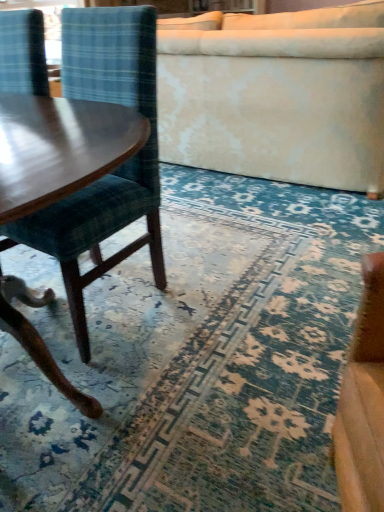
Identify the location of blue textured rug at center. (196, 358).

This screenshot has width=384, height=512. What do you see at coordinates (276, 95) in the screenshot?
I see `velvet cream studio couch at upper center` at bounding box center [276, 95].

You are a GUI agent. You are given a task and a screenshot of the screen. Output one action in this format:
    pyautogui.click(x=<x>, y=<y>)
    Task: Click on the velvet plaid chair at left
    This screenshot has height=512, width=384.
    Given the screenshot: What is the action you would take?
    pyautogui.click(x=118, y=168)

Image resolution: width=384 pixels, height=512 pixels. Find the location of `blue textured rug at center`. blue textured rug at center is located at coordinates (196, 358).

Is velvet plaid chair at left thinner than blue textured rug at center?

Yes, velvet plaid chair at left is thinner than blue textured rug at center.

Is point (135, 80) behind point (307, 480)?

That is True.

Can you confirm if velvet plaid chair at left is positioned to the right of blue textured rug at center?

Answer: In fact, velvet plaid chair at left is to the left of blue textured rug at center.

What's the angular difference between velvet plaid chair at left and blue textured rug at center's facing directions?

The angle between the facing direction of velvet plaid chair at left and the facing direction of blue textured rug at center is 177 degrees.

Is point (189, 28) less distant than point (381, 228)?

No, it is not.

Is velvet cream studio couch at upper center facing away from blue textured rug at center?

Correct, velvet cream studio couch at upper center is looking away from blue textured rug at center.

Is blue textured rug at center inside velvet cream studio couch at upper center?

No, blue textured rug at center is not surrounded by velvet cream studio couch at upper center.

You are a GUI agent. You are given a task and a screenshot of the screen. Output one action in this format:
    pyautogui.click(x=<x>, y=<y>)
    Task: Click on the mat below the velvet cream studio couch at upper center (from the image's perspective)
    The image size is (384, 512).
    Given the screenshot: What is the action you would take?
    pyautogui.click(x=196, y=358)

Is blue textured rug at center wider or thinner than velvet plaid chair at left?

Considering their sizes, blue textured rug at center looks broader than velvet plaid chair at left.

Is blue textured rug at center looking in the opposite direction of velvet plaid chair at left?

That's not correct — blue textured rug at center is not looking away from velvet plaid chair at left.

Consider the image. What's the angular difference between blue textured rug at center and velvet plaid chair at left's facing directions?

177 degrees.

Is blue textured rug at center inside or outside of velvet plaid chair at left?

blue textured rug at center cannot be found inside velvet plaid chair at left.

From the picture: Between velvet cream studio couch at upper center and velvet plaid chair at left, which one appears on the right side from the viewer's perspective?

Positioned to the right is velvet cream studio couch at upper center.

Considering the sizes of objects velvet cream studio couch at upper center and velvet plaid chair at left in the image provided, who is smaller, velvet cream studio couch at upper center or velvet plaid chair at left?

Smaller between the two is velvet plaid chair at left.

Is velvet cream studio couch at upper center not inside velvet plaid chair at left?

Absolutely, velvet cream studio couch at upper center is external to velvet plaid chair at left.

From a real-world perspective, who is located lower, velvet cream studio couch at upper center or velvet plaid chair at left?

velvet cream studio couch at upper center is physically lower.

Does blue textured rug at center appear on the left side of velvet cream studio couch at upper center?

Yes.

Is blue textured rug at center not within velvet cream studio couch at upper center?

blue textured rug at center lies outside velvet cream studio couch at upper center's area.

Identify the location of studio couch above the blue textured rug at center (from the image's perspective). (276, 95).

What's the angular difference between blue textured rug at center and velvet cream studio couch at upper center's facing directions?

1.34 degrees separate the facing orientations of blue textured rug at center and velvet cream studio couch at upper center.

Is velvet plaid chair at left bigger or smaller than velvet cream studio couch at upper center?

Clearly, velvet plaid chair at left is smaller in size than velvet cream studio couch at upper center.

Which object is thinner, velvet plaid chair at left or velvet cream studio couch at upper center?

With smaller width is velvet plaid chair at left.

From the image's perspective, is velvet plaid chair at left located above or below velvet cream studio couch at upper center?

Clearly, from the image's perspective, velvet plaid chair at left is below velvet cream studio couch at upper center.

Where is `mat in front of the velvet plaid chair at left`? The width and height of the screenshot is (384, 512). mat in front of the velvet plaid chair at left is located at coordinates (196, 358).

I want to click on studio couch on the right of blue textured rug at center, so click(x=276, y=95).

When comparing their distances from blue textured rug at center, does velvet cream studio couch at upper center or velvet plaid chair at left seem closer?

velvet plaid chair at left lies closer to blue textured rug at center than the other object.

Estimate the real-world distances between objects in this image. Which object is closer to velvet plaid chair at left, blue textured rug at center or velvet cream studio couch at upper center?

Based on the image, blue textured rug at center appears to be nearer to velvet plaid chair at left.

Which object lies nearer to the anchor point velvet plaid chair at left, velvet cream studio couch at upper center or blue textured rug at center?

blue textured rug at center lies closer to velvet plaid chair at left than the other object.

Considering their positions, is velvet plaid chair at left positioned closer to velvet cream studio couch at upper center than blue textured rug at center?

blue textured rug at center is positioned closer to the anchor velvet cream studio couch at upper center.

Based on their spatial positions, is velvet plaid chair at left or velvet cream studio couch at upper center closer to blue textured rug at center?

velvet plaid chair at left is positioned closer to the anchor blue textured rug at center.

Consider the image. Based on their spatial positions, is blue textured rug at center or velvet plaid chair at left closer to velvet cream studio couch at upper center?

blue textured rug at center.

You are a GUI agent. You are given a task and a screenshot of the screen. Output one action in this format:
    pyautogui.click(x=<x>, y=<y>)
    Task: Click on the chair between velvet cream studio couch at upper center and blue textured rug at center in the up-down direction
    Image resolution: width=384 pixels, height=512 pixels.
    Given the screenshot: What is the action you would take?
    pyautogui.click(x=118, y=168)